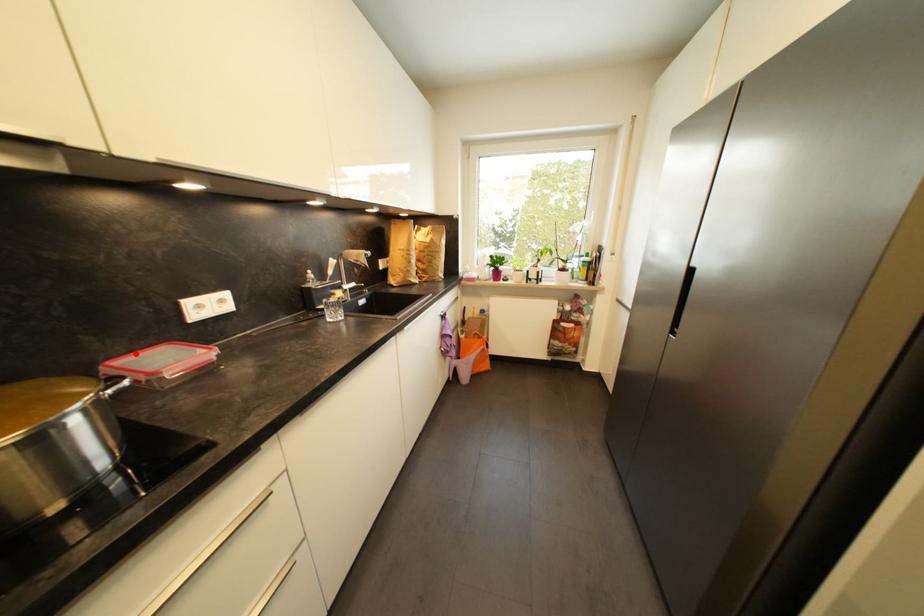
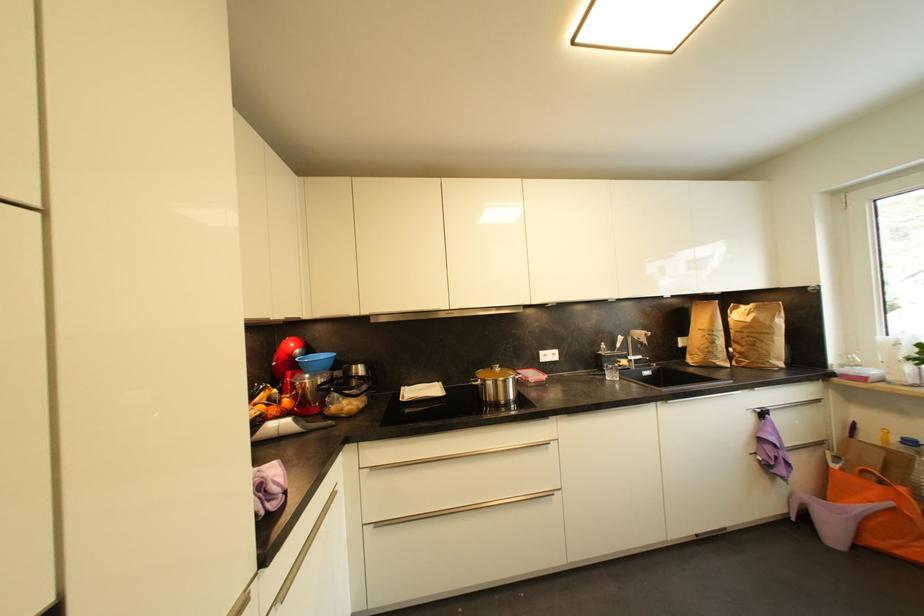
The point at the highlighted location is marked in the first image. Where is the corresponding point in the second image?

(528, 371)